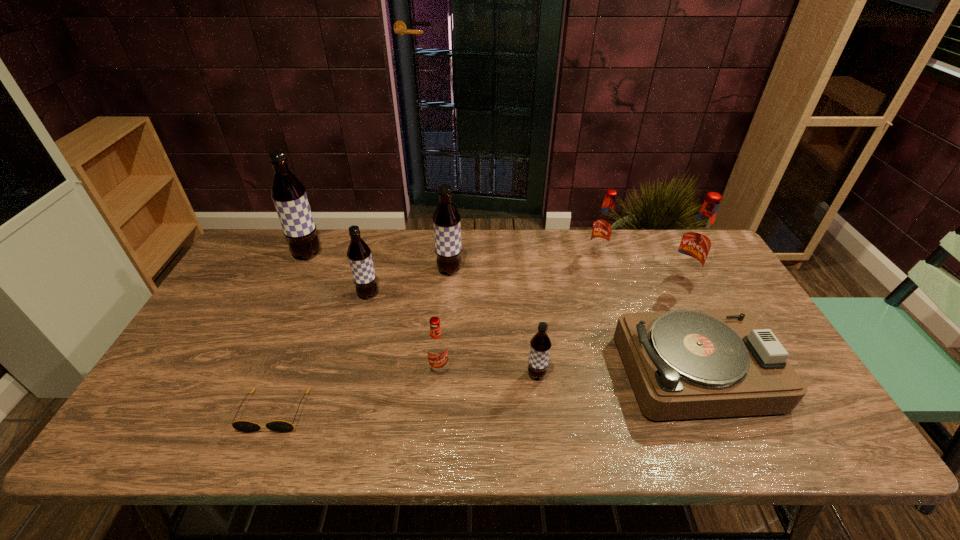
At what (x,y) coordinates should I click in order to perform the action: click on the leftmost brown root beer. Please return your answer as a coordinate pair (x, y). Looking at the image, I should click on (289, 196).

This screenshot has height=540, width=960. I want to click on the leftmost root beer, so click(289, 196).

This screenshot has height=540, width=960. Find the location of `the rightmost red root beer`. the rightmost red root beer is located at coordinates (696, 242).

Locate an element on the screen. the second nearest red root beer is located at coordinates (696, 242).

Locate an element on the screen. the second brown root beer from right to left is located at coordinates (446, 220).

The height and width of the screenshot is (540, 960). Find the location of `the second brown root beer from left to right`. the second brown root beer from left to right is located at coordinates (359, 255).

The height and width of the screenshot is (540, 960). Find the location of `the second root beer from left to right`. the second root beer from left to right is located at coordinates (359, 255).

This screenshot has width=960, height=540. I want to click on the second root beer from right to left, so click(x=603, y=227).

Locate an element on the screen. This screenshot has height=540, width=960. the second biggest red root beer is located at coordinates (603, 227).

Where is `the nearest red root beer`? The width and height of the screenshot is (960, 540). the nearest red root beer is located at coordinates (437, 350).